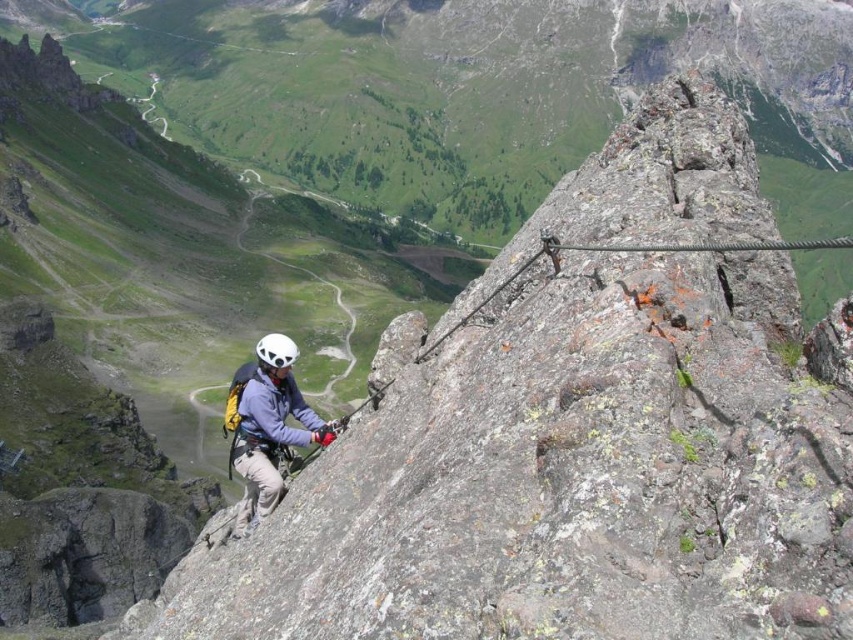
Is point (300, 429) more distant than point (286, 372)?

Yes, it is.

Does matte gray helmet at center appear on the right side of white matte helmet at center?

Yes, matte gray helmet at center is to the right of white matte helmet at center.

Where is `matte gray helmet at center`? The image size is (853, 640). matte gray helmet at center is located at coordinates [267, 424].